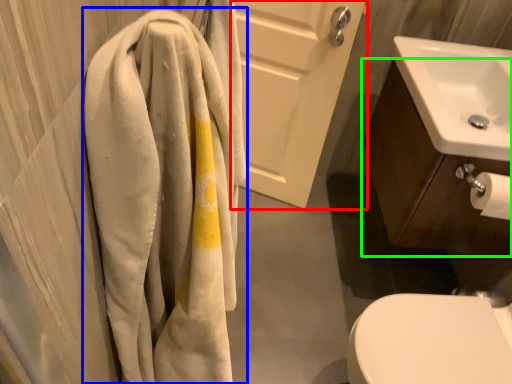
Question: Which object is the closest to the screen door (highlighted by a red box)? Choose among these: towel (highlighted by a blue box) or bathroom cabinet (highlighted by a green box).

Choices:
 (A) towel
 (B) bathroom cabinet

Answer: (B)